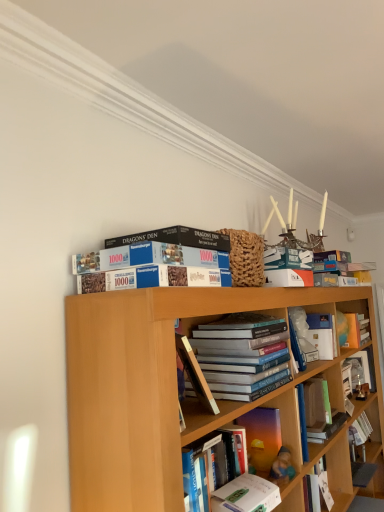
Question: In which direction should I rotate to look at orange matte bookshelf at upper center, the eighth book in the front-to-back sequence?

Choices:
 (A) right
 (B) left

Answer: (A)

Question: Which direction should I rotate to look at white glossy book at center, the sixth book from the front?

Choices:
 (A) right
 (B) left

Answer: (A)

Question: Considering the relative positions of white glossy book at center, which is counted as the fourth book, starting from the back, and white glossy book at upper center, the 5th book positioned from the back, in the image provided, is white glossy book at center, which is counted as the fourth book, starting from the back, in front of white glossy book at upper center, the 5th book positioned from the back,?

Choices:
 (A) yes
 (B) no

Answer: (B)

Question: Considering the relative sizes of white glossy book at center, which is counted as the fourth book, starting from the back, and white glossy book at upper center, the 5th book positioned from the back, in the image provided, is white glossy book at center, which is counted as the fourth book, starting from the back, thinner than white glossy book at upper center, the 5th book positioned from the back,?

Choices:
 (A) yes
 (B) no

Answer: (B)

Question: Considering the relative positions of white glossy book at center, which is counted as the fourth book, starting from the back, and white glossy book at upper center, which is the 5th book from front to back, in the image provided, is white glossy book at center, which is counted as the fourth book, starting from the back, to the left of white glossy book at upper center, which is the 5th book from front to back, from the viewer's perspective?

Choices:
 (A) no
 (B) yes

Answer: (A)

Question: Is white glossy book at center, the sixth book from the front, outside of white glossy book at upper center, the 5th book positioned from the back?

Choices:
 (A) yes
 (B) no

Answer: (A)

Question: Considering the relative sizes of white glossy book at center, the sixth book from the front, and white glossy book at upper center, which is the 5th book from front to back, in the image provided, is white glossy book at center, the sixth book from the front, shorter than white glossy book at upper center, which is the 5th book from front to back,?

Choices:
 (A) yes
 (B) no

Answer: (B)

Question: Does white glossy book at center, the sixth book from the front, contain white glossy book at upper center, the 5th book positioned from the back?

Choices:
 (A) yes
 (B) no

Answer: (B)

Question: From the image's perspective, is wooden photo frame at right, placed as the ninth book when sorted from front to back, below white glossy book at upper center, which is the 5th book from front to back?

Choices:
 (A) yes
 (B) no

Answer: (B)

Question: Can you see wooden photo frame at right, which is the first book from back to front, touching white glossy book at upper center, the 5th book positioned from the back?

Choices:
 (A) no
 (B) yes

Answer: (A)

Question: Can you confirm if wooden photo frame at right, which is the first book from back to front, is smaller than white glossy book at upper center, the 5th book positioned from the back?

Choices:
 (A) yes
 (B) no

Answer: (B)

Question: Considering the relative sizes of wooden photo frame at right, placed as the ninth book when sorted from front to back, and white glossy book at upper center, which is the 5th book from front to back, in the image provided, is wooden photo frame at right, placed as the ninth book when sorted from front to back, thinner than white glossy book at upper center, which is the 5th book from front to back,?

Choices:
 (A) yes
 (B) no

Answer: (B)

Question: Is wooden photo frame at right, placed as the ninth book when sorted from front to back, completely or partially outside of white glossy book at upper center, which is the 5th book from front to back?

Choices:
 (A) no
 (B) yes

Answer: (B)

Question: Does wooden photo frame at right, placed as the ninth book when sorted from front to back, have a lesser height compared to white glossy book at upper center, which is the 5th book from front to back?

Choices:
 (A) yes
 (B) no

Answer: (B)

Question: Is wooden photo frame at right, placed as the ninth book when sorted from front to back, shorter than translucent plastic book at center, the sixth book in the back-to-front sequence?

Choices:
 (A) no
 (B) yes

Answer: (A)